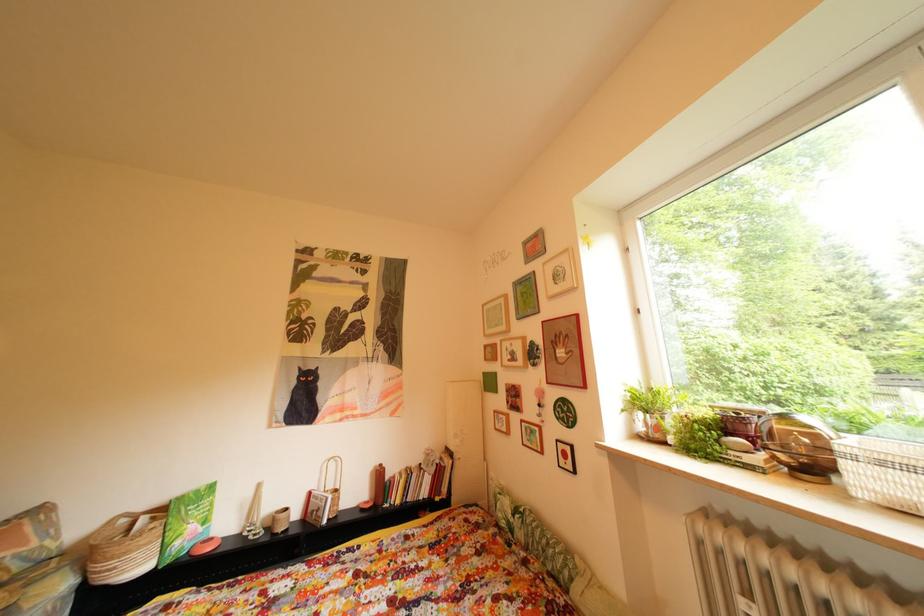
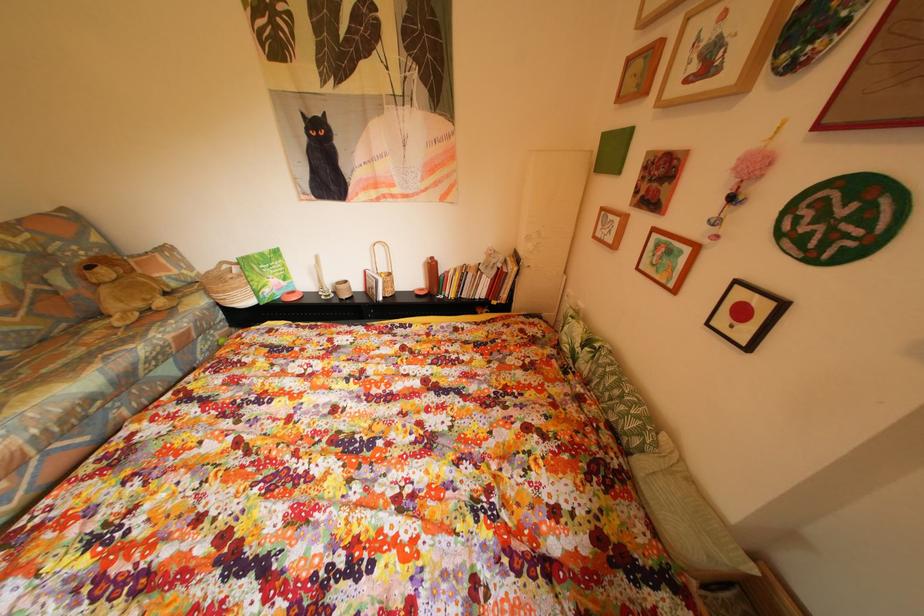
Based on the continuous images, in which direction is the camera rotating?

The camera rotated toward left-down.